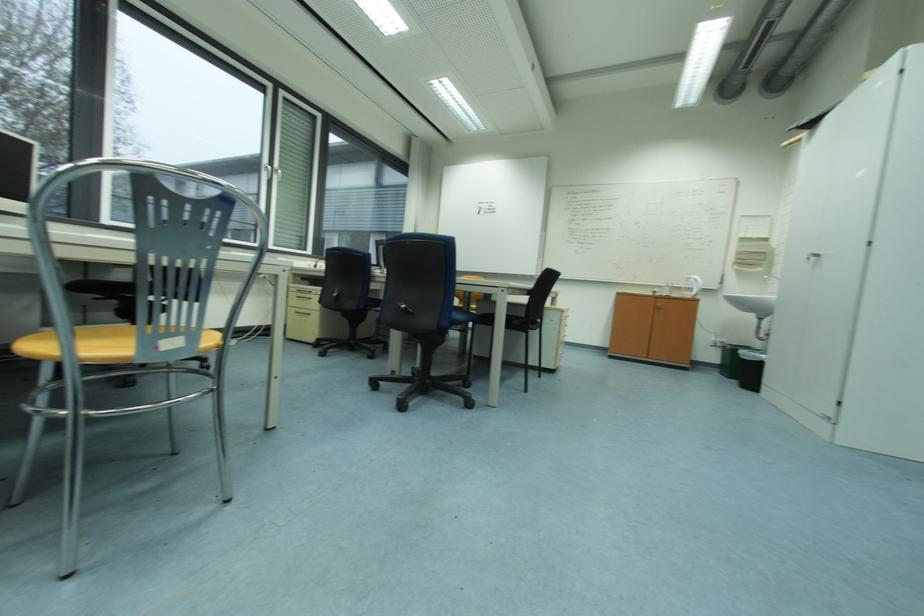
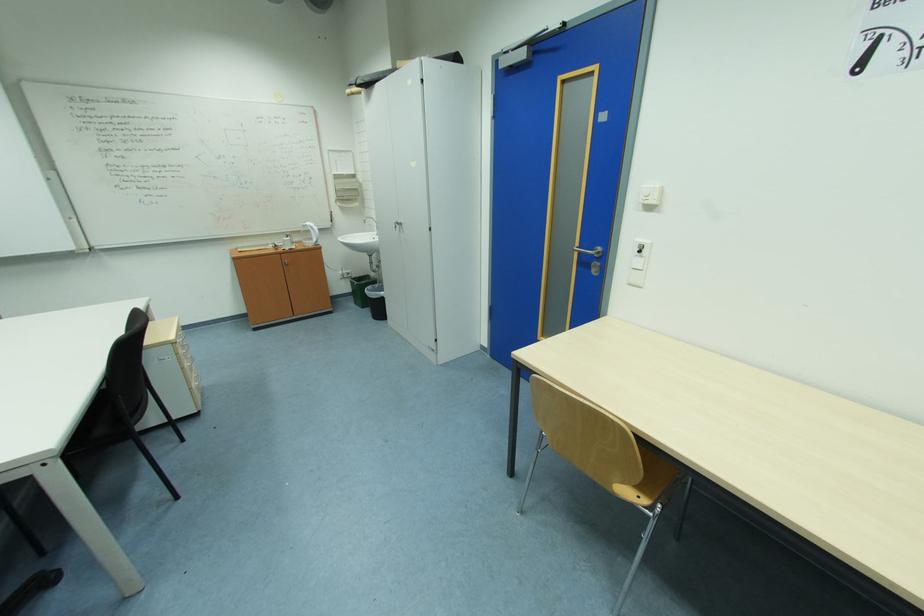
The point at [699,278] is marked in the first image. Where is the corresponding point in the second image?

(313, 225)